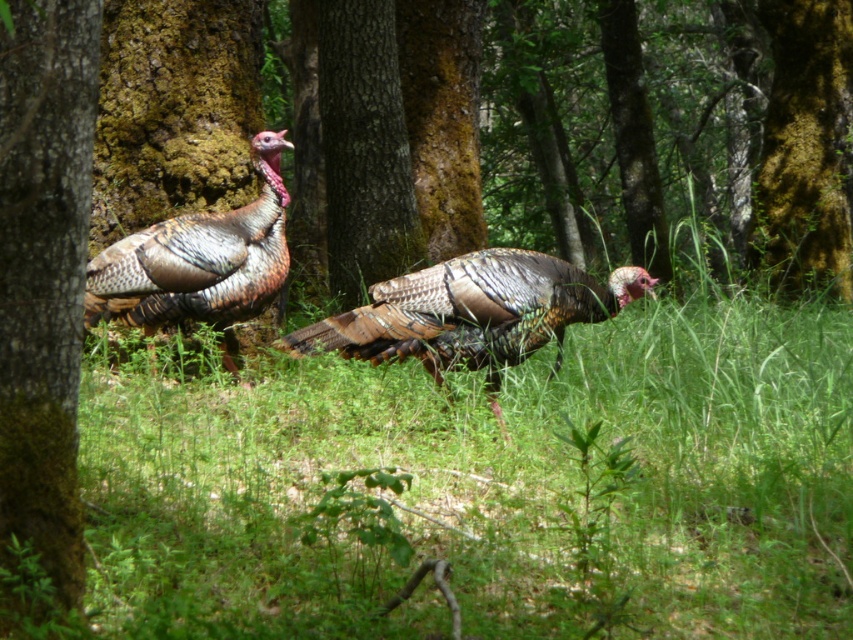
Question: Which object is positioned farthest from the green mossy bark at center?

Choices:
 (A) brown textured bark at left
 (B) multicolored feathered turkey at center
 (C) speckled feathered turkey at left

Answer: (A)

Question: Which point is farther to the camera?

Choices:
 (A) (x=518, y=324)
 (B) (x=845, y=116)
 (C) (x=28, y=490)

Answer: (B)

Question: Is multicolored feathered turkey at center above speckled feathered turkey at left?

Choices:
 (A) no
 (B) yes

Answer: (A)

Question: Is brown textured bark at left positioned at the back of multicolored feathered turkey at center?

Choices:
 (A) yes
 (B) no

Answer: (B)

Question: Estimate the real-world distances between objects in this image. Which object is closer to the green mossy bark at center?

Choices:
 (A) brown textured bark at left
 (B) speckled feathered turkey at left

Answer: (B)

Question: Does green mossy bark at center appear under speckled feathered turkey at left?

Choices:
 (A) yes
 (B) no

Answer: (B)